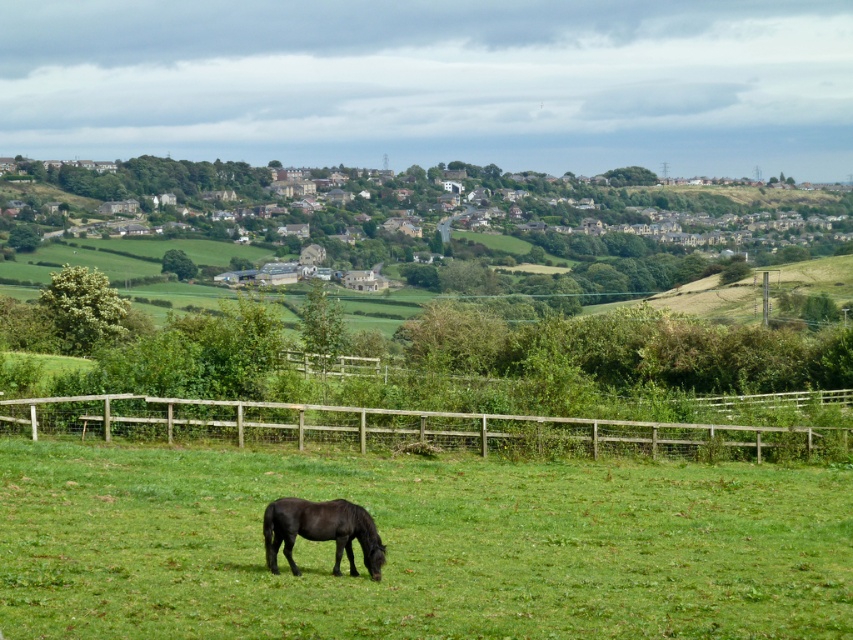
Question: Which object is positioned closest to the black glossy horse at lower center?

Choices:
 (A) brown wooden fence at lower center
 (B) green grassy field at center

Answer: (B)

Question: Can you confirm if green grassy field at center is wider than black glossy horse at lower center?

Choices:
 (A) no
 (B) yes

Answer: (B)

Question: Does green grassy field at center appear on the left side of black glossy horse at lower center?

Choices:
 (A) no
 (B) yes

Answer: (A)

Question: From the image, what is the correct spatial relationship of green grassy field at center in relation to brown wooden fence at lower center?

Choices:
 (A) above
 (B) below

Answer: (B)

Question: Which point is closer to the camera?

Choices:
 (A) (672, 420)
 (B) (372, 560)

Answer: (B)

Question: Which of the following is the farthest from the observer?

Choices:
 (A) brown wooden fence at lower center
 (B) black glossy horse at lower center

Answer: (A)